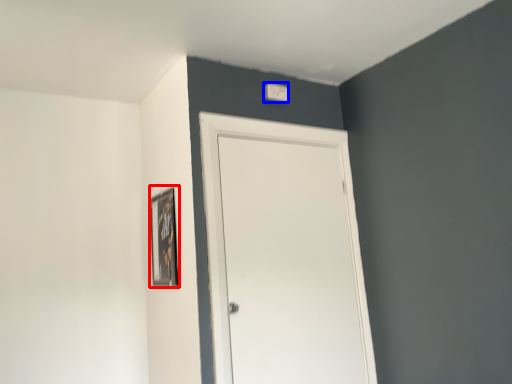
Question: Which of the following is the farthest to the observer, picture frame (highlighted by a red box) or light switch (highlighted by a blue box)?

Choices:
 (A) picture frame
 (B) light switch

Answer: (B)